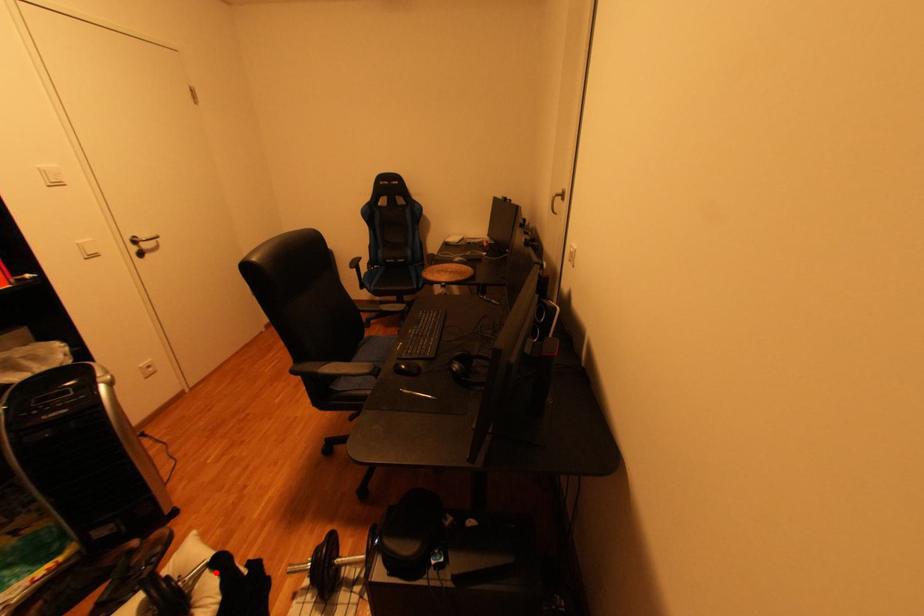
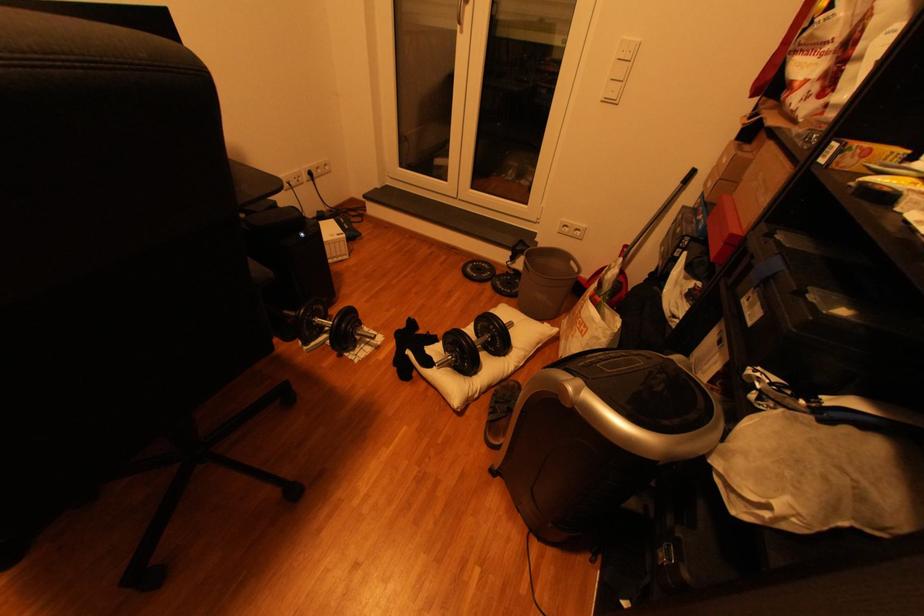
Question: I am providing you with two images of the same scene from different viewpoints. Image1 has a red point marked. In image2, the corresponding 3D location appears at what relative position? Reply with the corresponding letter.

Choices:
 (A) Closer
 (B) Farther

Answer: (B)